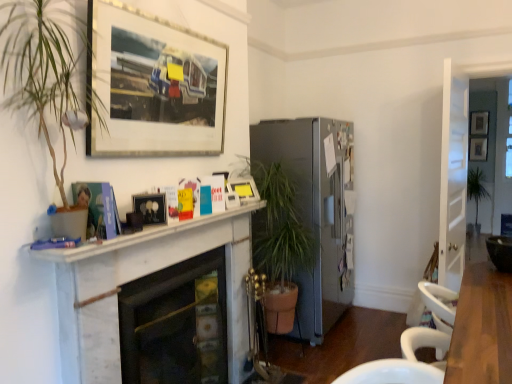
Question: Is white marble fireplace at center, arranged as the second fireplace when viewed from the front, wider than matte black picture frame at center, the second picture frame viewed from the front?

Choices:
 (A) yes
 (B) no

Answer: (A)

Question: From the image's perspective, would you say white marble fireplace at center, the 2th fireplace when ordered from back to front, is shown under matte black picture frame at center, the second picture frame viewed from the front?

Choices:
 (A) no
 (B) yes

Answer: (B)

Question: Does white marble fireplace at center, the 2th fireplace when ordered from back to front, have a larger size compared to matte black picture frame at center, which is the first picture frame in left-to-right order?

Choices:
 (A) yes
 (B) no

Answer: (A)

Question: Is white marble fireplace at center, arranged as the second fireplace when viewed from the front, further to camera compared to matte black picture frame at center, which is counted as the 4th picture frame, starting from the back?

Choices:
 (A) yes
 (B) no

Answer: (B)

Question: From the image's perspective, would you say white marble fireplace at center, arranged as the second fireplace when viewed from the front, is positioned over matte black picture frame at center, which is the first picture frame in left-to-right order?

Choices:
 (A) no
 (B) yes

Answer: (A)

Question: Is matte black picture frame at center, which is counted as the 4th picture frame, starting from the back, at the back of white marble fireplace at center, the 2th fireplace when ordered from back to front?

Choices:
 (A) yes
 (B) no

Answer: (B)

Question: Is wooden picture frame at upper right, the 1th picture frame from the back, to the left of matte white fireplace at center, marked as the third fireplace in a front-to-back arrangement, from the viewer's perspective?

Choices:
 (A) yes
 (B) no

Answer: (B)

Question: Does wooden picture frame at upper right, which is the 1th picture frame in right-to-left order, turn towards matte white fireplace at center, which appears as the first fireplace when viewed from the back?

Choices:
 (A) no
 (B) yes

Answer: (B)

Question: Are wooden picture frame at upper right, which is the 1th picture frame in right-to-left order, and matte white fireplace at center, marked as the third fireplace in a front-to-back arrangement, beside each other?

Choices:
 (A) yes
 (B) no

Answer: (B)

Question: Is matte white fireplace at center, which appears as the first fireplace when viewed from the back, at the back of wooden picture frame at upper right, which is the 1th picture frame in right-to-left order?

Choices:
 (A) no
 (B) yes

Answer: (A)

Question: Can you confirm if wooden picture frame at upper right, arranged as the fifth picture frame when viewed from the front, is thinner than matte white fireplace at center, marked as the third fireplace in a front-to-back arrangement?

Choices:
 (A) yes
 (B) no

Answer: (A)

Question: From a real-world perspective, is wooden picture frame at upper right, the 1th picture frame from the back, on matte white fireplace at center, marked as the third fireplace in a front-to-back arrangement?

Choices:
 (A) no
 (B) yes

Answer: (B)

Question: Is matte black picture frame at center, the fifth picture frame viewed from the right, not near white marble fireplace at center, the 2th fireplace when ordered from back to front?

Choices:
 (A) no
 (B) yes

Answer: (A)